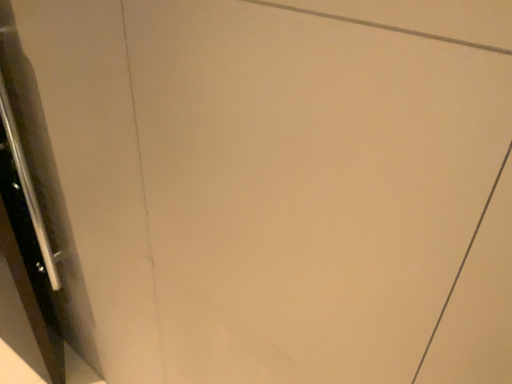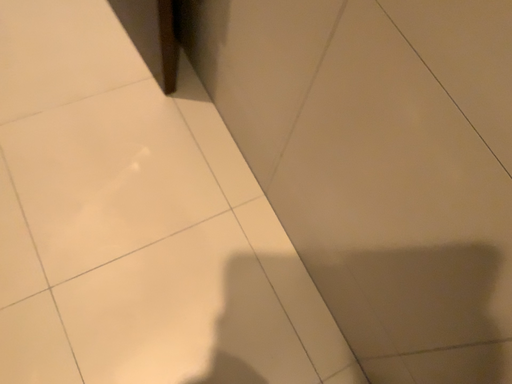
Question: Which way did the camera rotate in the video?

Choices:
 (A) rotated downward
 (B) rotated upward

Answer: (A)